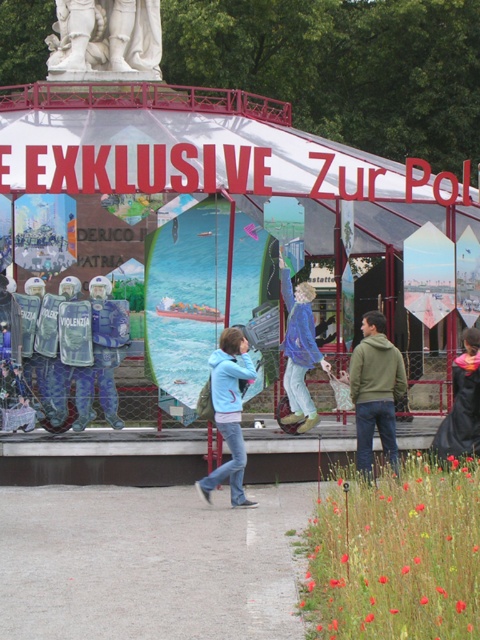
Where is the light blue hoodie at center located in the image?

The light blue hoodie at center is located at point 0.645 on the x axis and 0.477 on the y axis.

You are an event organizer setting up for a themed exhibition. You have a blue fabric riot shield at center and a black fabric coat at right. Which object should you place in a more prominent position to emphasize its size?

The blue fabric riot shield at center should be placed in a more prominent position since it is larger in size than the black fabric coat at right.